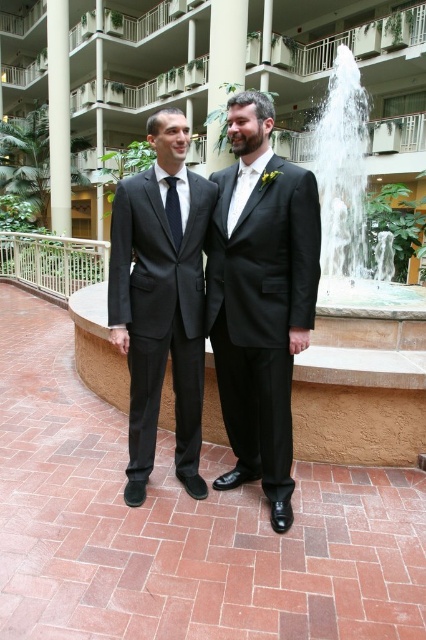
You are a photographer setting up for an outdoor event at the hotel courtyard. You need to position a large camera tripod between the matte black suit at left and the white glossy pillar at left. Based on the scene description, can the tripod be placed there without blocking either object?

The matte black suit at left is positioned under the white glossy pillar at left, so placing a tripod between them might not be feasible as the suit is already under the pillar, leaving little space. The tripod would likely block one or both objects.

You are a photographer setting up for a group photo in the courtyard. You need to position the two men so that their suits don not clash in the lighting. Which man wearing a shiny black suit at center should stand where relative to the matte black suit at center?

The shiny black suit at center should be placed to the right of the matte black suit at center to avoid clashing in the lighting.

You are a photographer setting up a camera to capture the two men in the scene. You need to ensure that both the shiny black suit at center and the black silk tie at center are fully visible in the frame. Which object should you focus on to ensure the entire width of both items fits within the camera view?

The shiny black suit at center is wider than the black silk tie at center, so focusing on the shiny black suit at center will ensure both items fit within the camera view.